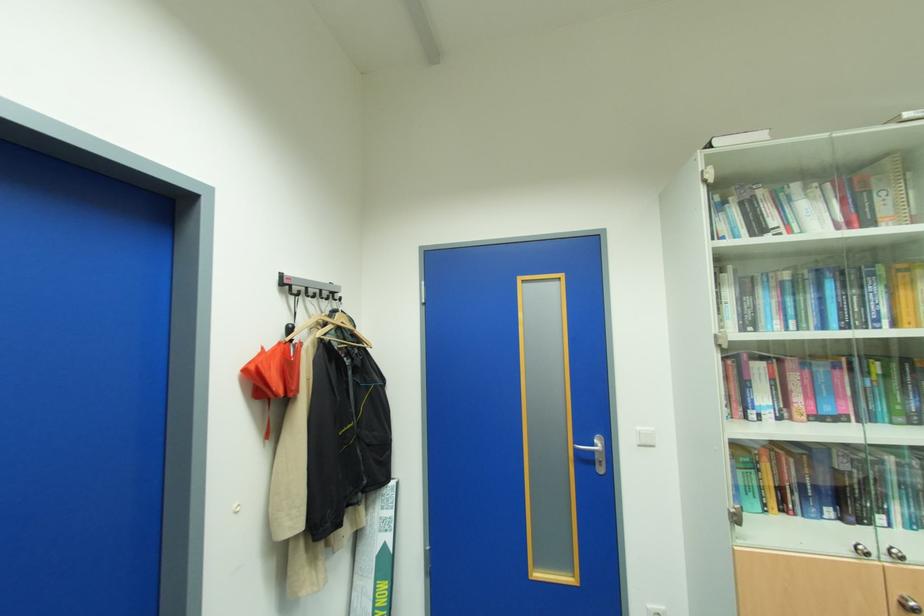
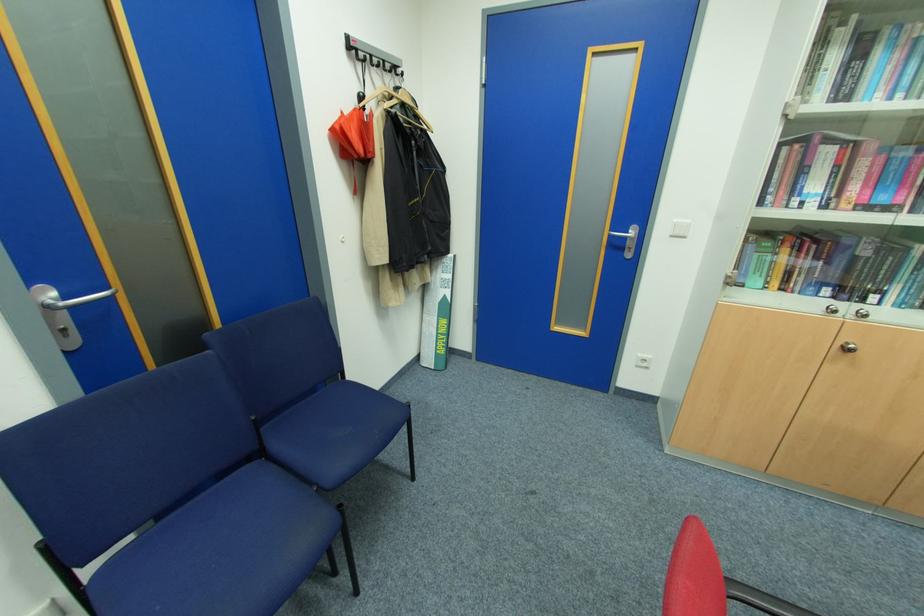
Find the pixel in the second image that matches point 642,446 in the first image.

(675, 236)